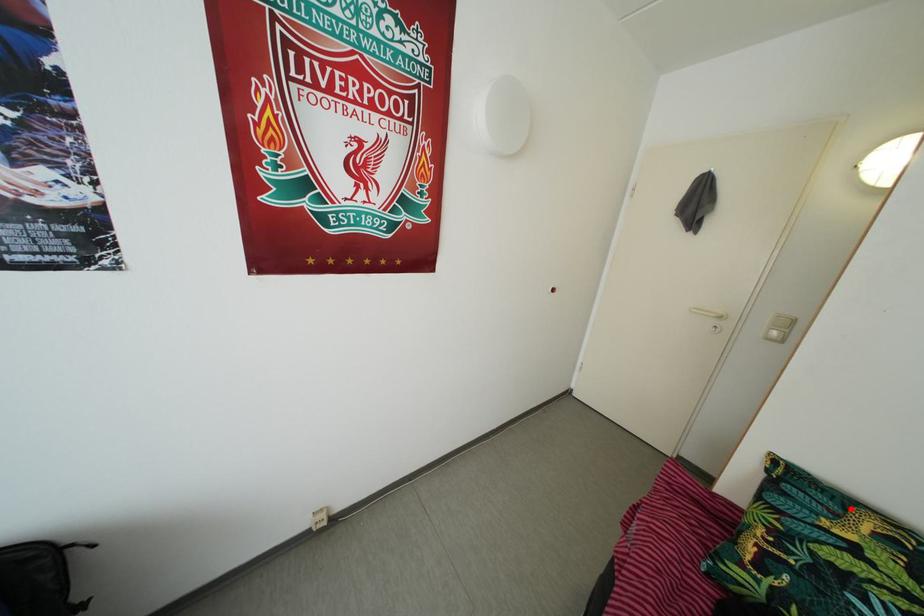
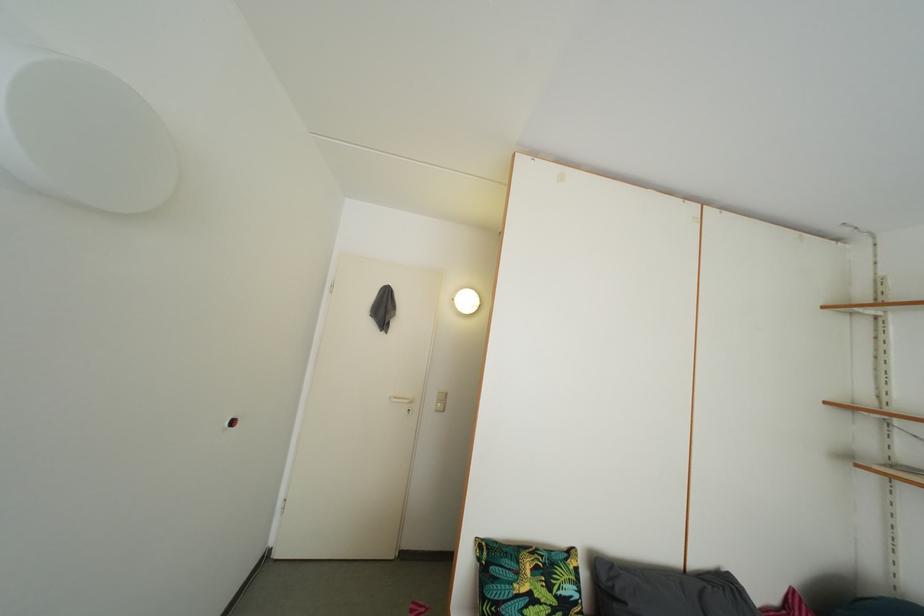
Find the pixel in the second image that matches the highlighted location in the first image.

(521, 562)